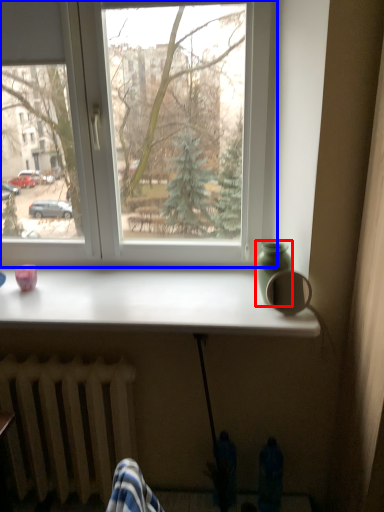
Question: Among these objects, which one is nearest to the camera, glass vase (highlighted by a red box) or window (highlighted by a blue box)?

Choices:
 (A) glass vase
 (B) window

Answer: (A)